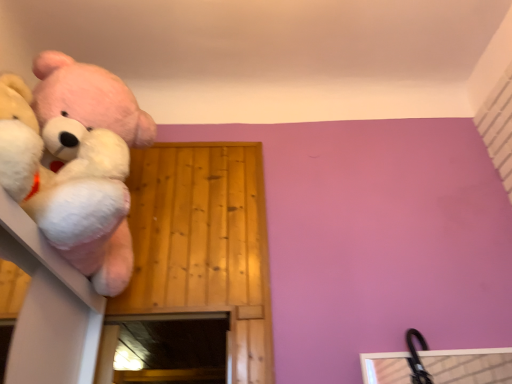
Describe the element at coordinates (69, 191) in the screenshot. This screenshot has height=384, width=512. I see `fluffy pink teddy bear at left` at that location.

In order to click on fluffy pink teddy bear at left in this screenshot , I will do `click(69, 191)`.

Measure the distance between fluffy pink teddy bear at left and camera.

3.45 feet.

Where is `fluffy pink teddy bear at left`? Image resolution: width=512 pixels, height=384 pixels. fluffy pink teddy bear at left is located at coordinates (69, 191).